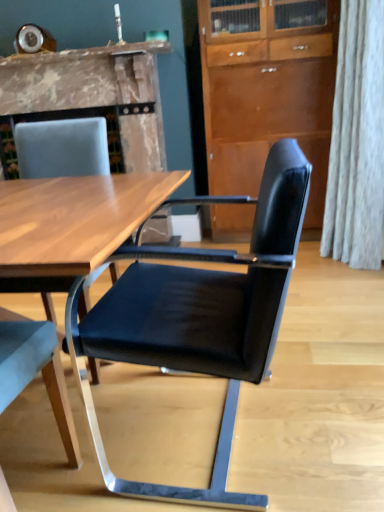
Identify the location of unoccupied region to the right of black leather chair at center, which is the second chair in left-to-right order. (339, 407).